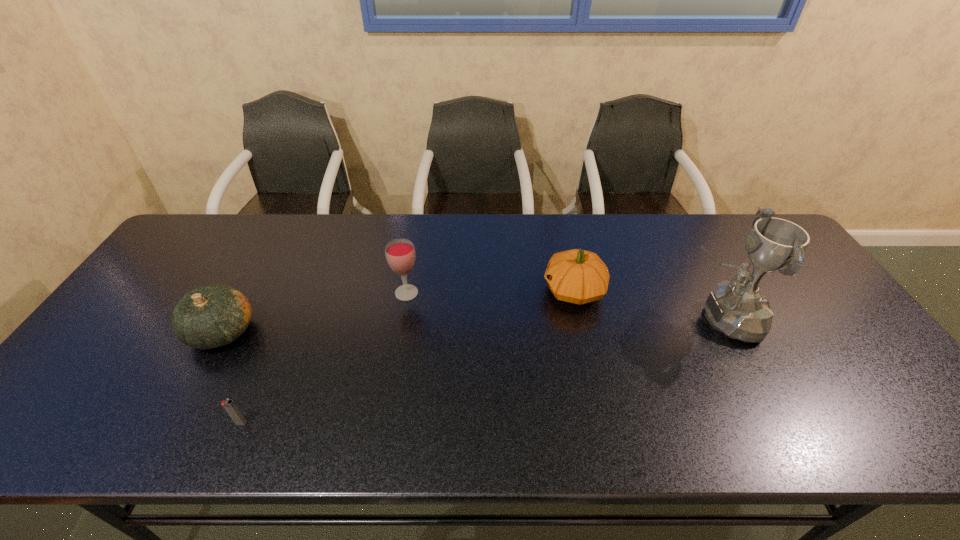
The width and height of the screenshot is (960, 540). Find the location of `free space between the nearest object and the right gourd`. free space between the nearest object and the right gourd is located at coordinates (408, 356).

The height and width of the screenshot is (540, 960). What are the coordinates of `unoccupied area between the third object from right to left and the second object from right to left` in the screenshot? It's located at (491, 292).

The image size is (960, 540). Find the location of `free point between the wineglass and the leftmost object`. free point between the wineglass and the leftmost object is located at coordinates (314, 312).

Locate which object is the third closest to the shortest object. Please provide its 2D coordinates. Your answer should be formatted as a tuple, i.e. [(x, y)], where the tuple contains the x and y coordinates of a point satisfying the conditions above.

[(577, 276)]

I want to click on object that is the fourth closest to the igniter, so click(738, 309).

Locate an element on the screen. free location that satisfies the following two spatial constraints: 1. on the side of the second object from right to left with the carved face; 2. on the front side of the leftmost object is located at coordinates (583, 332).

Locate an element on the screen. free spot that satisfies the following two spatial constraints: 1. on the side with emblem of the tallest object; 2. on the front side of the fourth object from right to left is located at coordinates (778, 423).

The height and width of the screenshot is (540, 960). I want to click on free location that satisfies the following two spatial constraints: 1. on the side with emblem of the rightmost object; 2. on the front side of the left gourd, so click(729, 332).